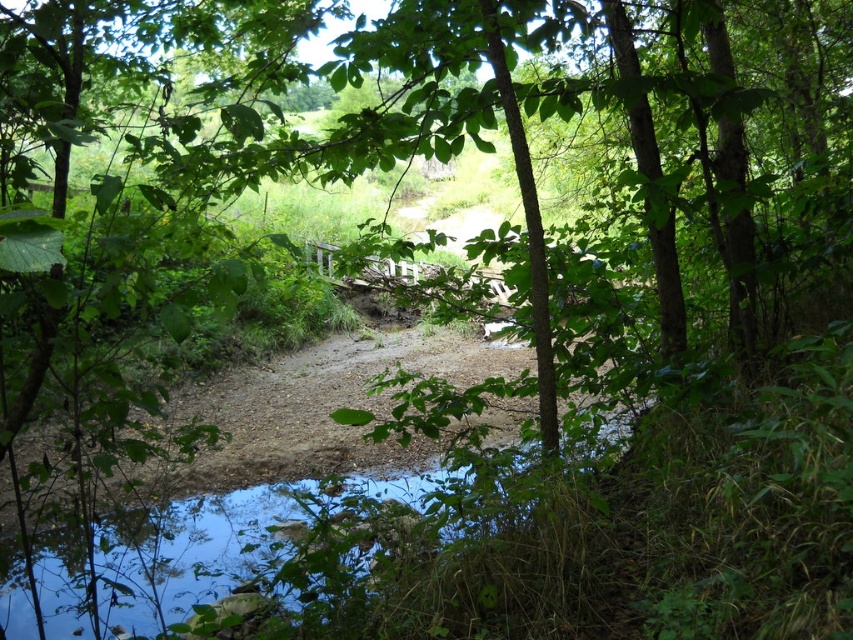
Looking at this image, you are a hiker trying to cross the clear water at bottom using the brown gravel dirt track at center. Can you safely step onto the track from the water without getting your feet wet?

The brown gravel dirt track at center is much taller than the clear water at bottom, so stepping onto it from the water would keep your feet dry.

You are standing at the point labeled as point (x=315, y=410) in the image. What is the immediate surface you are standing on?

The immediate surface you are standing on is the brown gravel dirt track at center indicated by point (x=315, y=410).